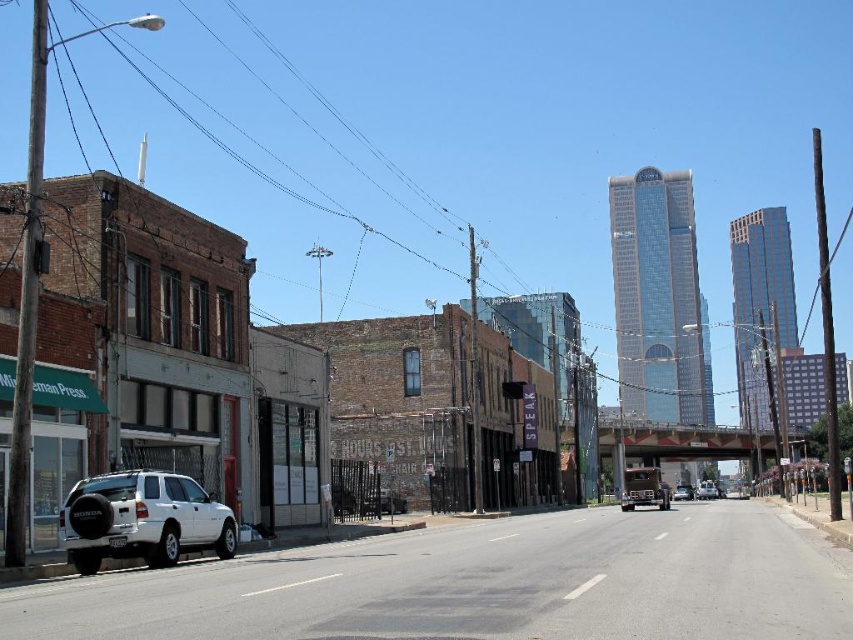
You are standing at the point marked as point (142, 518) in the image. What object is located exactly at that point?

The white matte suv at lower left is located exactly at point (142, 518).

You are a delivery driver who needs to park your truck, which is 20 feet long, between the white matte suv at lower left and the metallic silver sedan at center. Is there enough space between them to park your truck?

The distance between the white matte suv at lower left and the metallic silver sedan at center is 202.70 feet, so yes, there is enough space to park a 20 feet long truck between them.

You are a delivery driver who needs to park your vehicle in a tight space near the Mann Press building. Your vehicle is the same size as the white matte suv at lower left. Can you fit into the parking spot that currently holds the white matte truck at center?

The white matte suv at lower left is smaller than the white matte truck at center. Since your vehicle is the same size as the suv, it is smaller than the truck currently occupying the parking spot. Therefore, your vehicle should fit into the parking spot as it is larger than your vehicle.